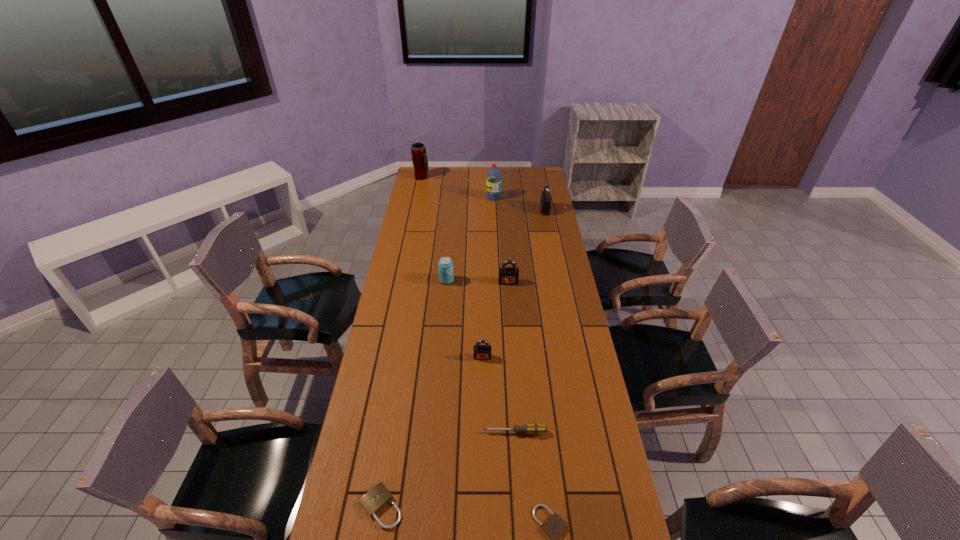
This screenshot has width=960, height=540. Identify the location of the fourth shortest object. (481, 352).

This screenshot has width=960, height=540. I want to click on screwdriver, so click(x=535, y=429).

Where is `the seventh tallest object`? the seventh tallest object is located at coordinates (535, 429).

Locate an element on the screen. Image resolution: width=960 pixels, height=540 pixels. the fourth tallest padlock is located at coordinates (373, 501).

Where is `the left beige padlock`? The height and width of the screenshot is (540, 960). the left beige padlock is located at coordinates (373, 501).

Locate an element on the screen. The width and height of the screenshot is (960, 540). vacant space positioned 0.240m on the front label of the water bottle is located at coordinates (494, 226).

Locate an element on the screen. The image size is (960, 540). vacant space situated 0.150m on the side with the handle of the red thermos bottle is located at coordinates (456, 178).

Locate an element on the screen. The height and width of the screenshot is (540, 960). vacant space located 0.270m on the front of the farthest gray padlock near the keyhole is located at coordinates (489, 210).

The width and height of the screenshot is (960, 540). In order to click on free space located on the front of the farthest gray padlock near the keyhole in this screenshot , I will do `click(489, 210)`.

Identify the location of free space located 0.210m on the front of the farthest gray padlock near the keyhole. The image size is (960, 540). (499, 210).